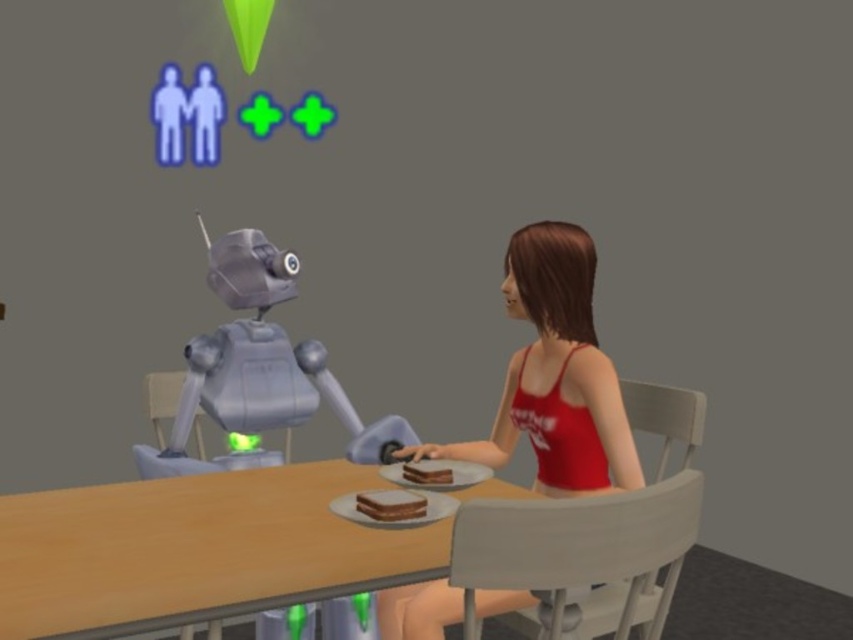
Question: Which of the following is the farthest from the observer?

Choices:
 (A) wooden table at center
 (B) metallic gray chair at left
 (C) chocolate cake at center

Answer: (B)

Question: Is the position of red matte tank top at center more distant than that of white plastic chair at lower right?

Choices:
 (A) no
 (B) yes

Answer: (B)

Question: Which point is farther from the camera taking this photo?

Choices:
 (A) (164, 397)
 (B) (157, 458)

Answer: (A)

Question: Which point is farther to the camera?

Choices:
 (A) (260, 461)
 (B) (672, 554)
 (C) (146, 388)
 (D) (447, 483)

Answer: (C)

Question: Is wooden table at center wider than chocolate cake at center?

Choices:
 (A) yes
 (B) no

Answer: (A)

Question: Does white plastic chair at lower right come in front of metallic gray chair at left?

Choices:
 (A) yes
 (B) no

Answer: (A)